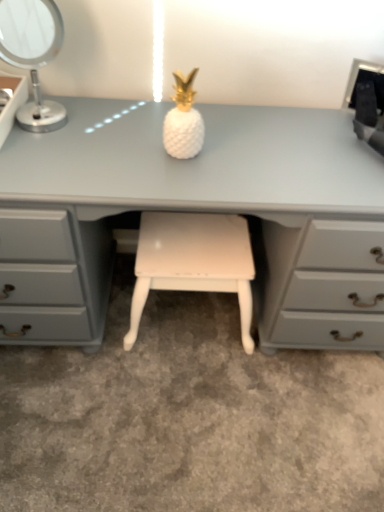
Where is `vacant area that lies between silver metallic table lamp at upper left and black plastic desktop computer at upper right`? vacant area that lies between silver metallic table lamp at upper left and black plastic desktop computer at upper right is located at coordinates (208, 124).